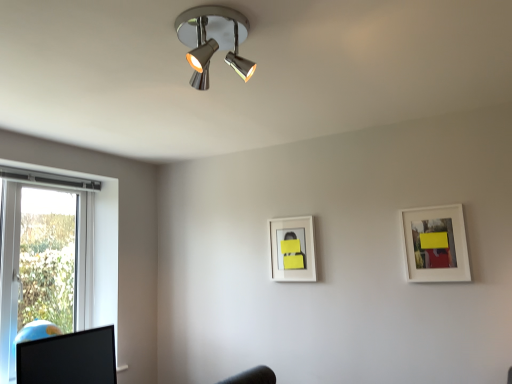
Question: In terms of height, does white matte picture frame at upper right, placed as the 2th picture frame when sorted from back to front, look taller or shorter compared to white matte picture frame at center, the first picture frame in the back-to-front sequence?

Choices:
 (A) tall
 (B) short

Answer: (A)

Question: Based on their sizes in the image, would you say white matte picture frame at upper right, arranged as the first picture frame when viewed from the right, is bigger or smaller than white matte picture frame at center, which is the second picture frame from right to left?

Choices:
 (A) small
 (B) big

Answer: (B)

Question: Which of these objects is positioned closest to the chrome/metallic spotlight at upper center?

Choices:
 (A) white matte picture frame at upper right, which appears as the second picture frame when viewed from the left
 (B) white matte picture frame at center, which is the second picture frame from right to left
 (C) black glossy computer monitor at lower left

Answer: (B)

Question: Considering the real-world distances, which object is closest to the chrome/metallic spotlight at upper center?

Choices:
 (A) white matte picture frame at center, which is the second picture frame from right to left
 (B) white matte picture frame at upper right, which appears as the second picture frame when viewed from the left
 (C) black glossy computer monitor at lower left

Answer: (A)